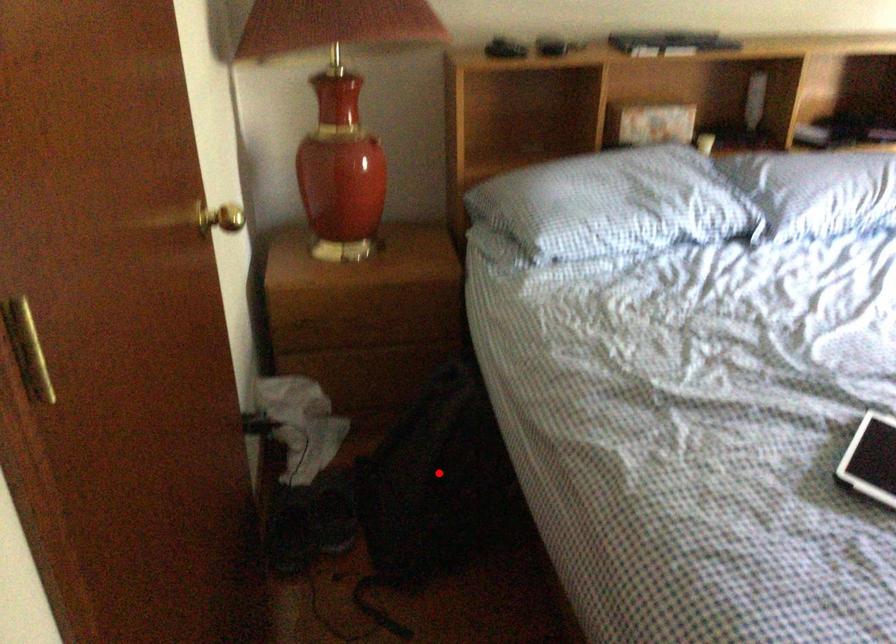
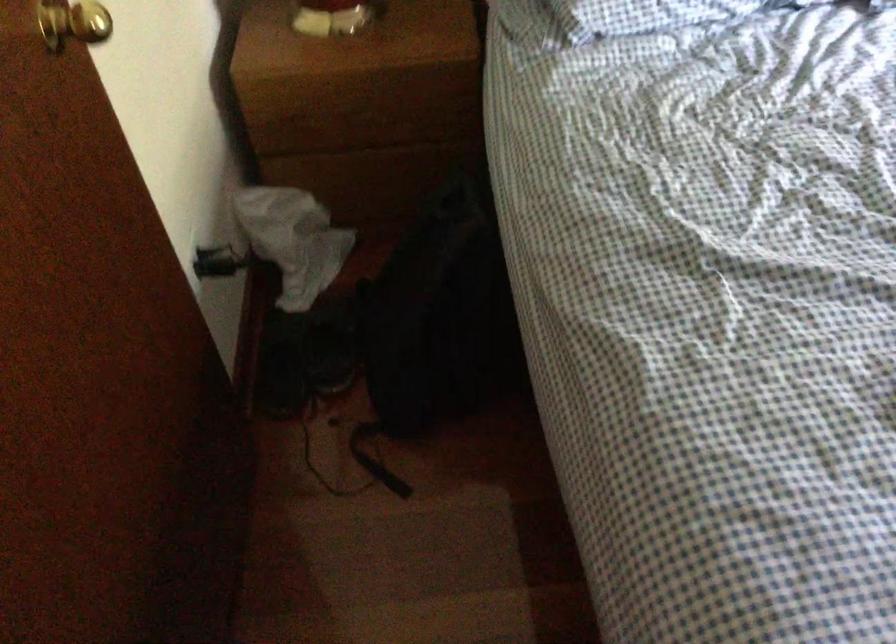
Where in the second image is the point corresponding to the highlighted location from the first image?

(441, 317)